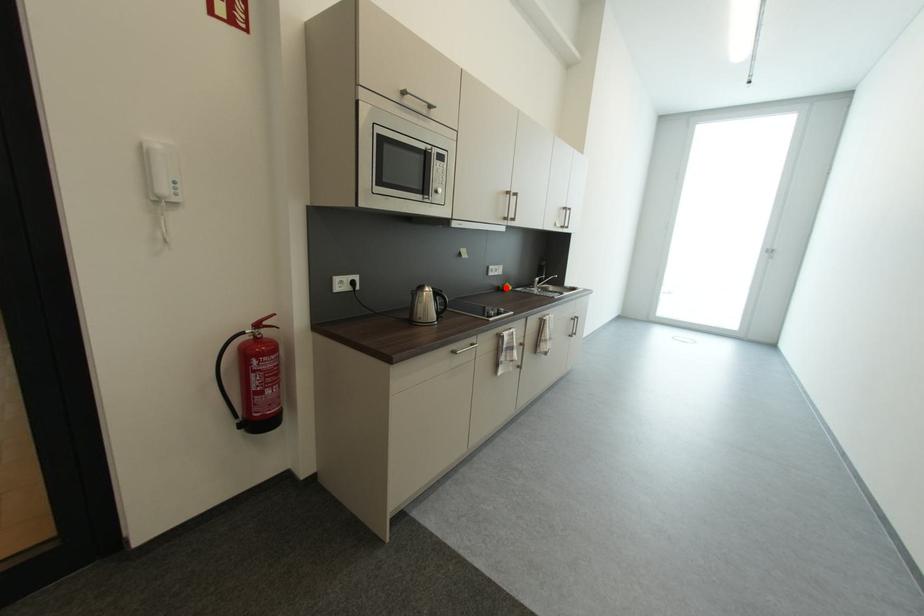
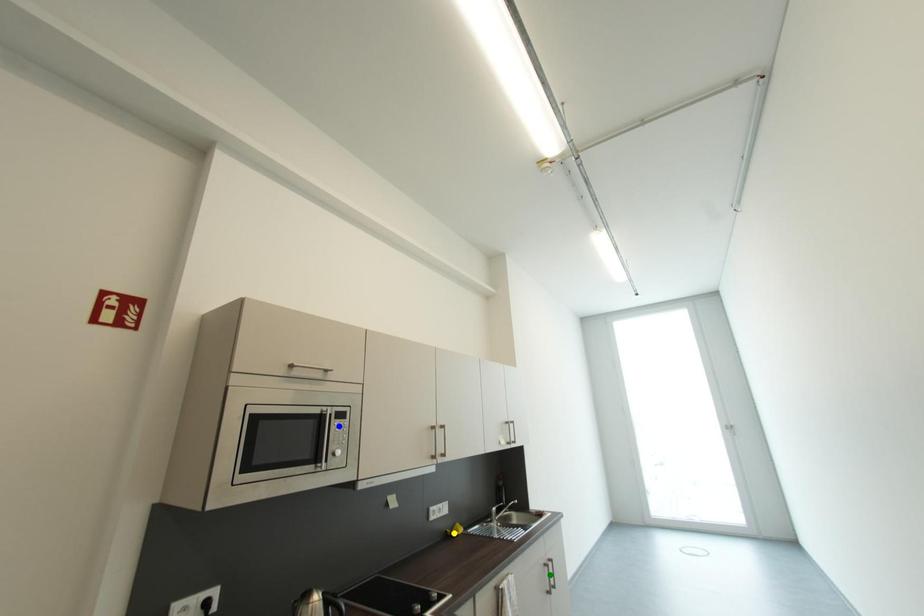
Question: I am providing you with two images of the same scene from different viewpoints. A red point is marked on the first image. You are given multiple points on the second image. Can you choose the point in image 2 that corresponds to the point in image 1?

Choices:
 (A) blue point
 (B) green point
 (C) yellow point

Answer: (C)